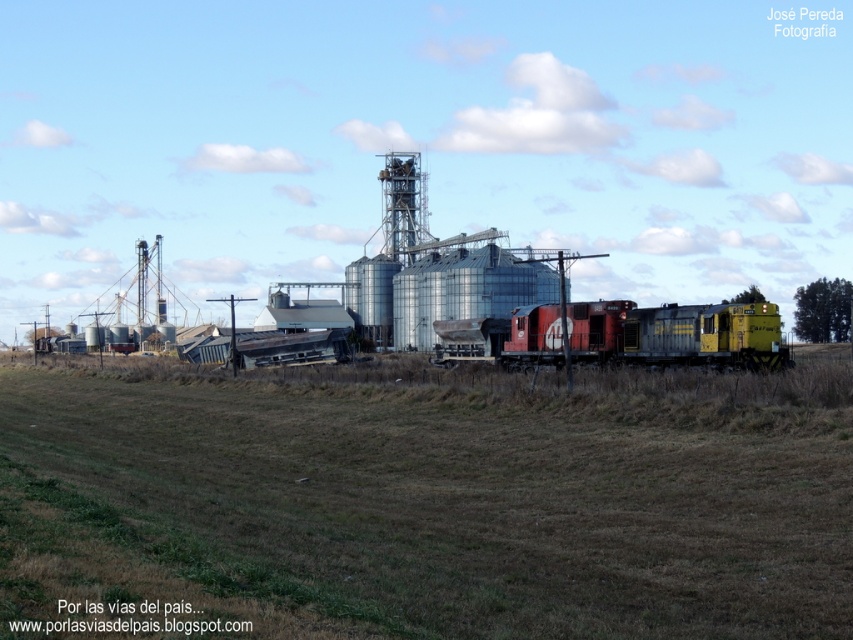
Question: Can you confirm if brown grass at center is positioned to the right of red/yellow painted metal train at center?

Choices:
 (A) yes
 (B) no

Answer: (B)

Question: Which point is farther to the camera?

Choices:
 (A) red/yellow painted metal train at center
 (B) brown grass at center

Answer: (A)

Question: Which point appears farthest from the camera in this image?

Choices:
 (A) (822, 628)
 (B) (606, 337)

Answer: (B)

Question: Is brown grass at center smaller than red/yellow painted metal train at center?

Choices:
 (A) yes
 (B) no

Answer: (B)

Question: Is the position of brown grass at center less distant than that of red/yellow painted metal train at center?

Choices:
 (A) yes
 (B) no

Answer: (A)

Question: Which of the following is the closest to the observer?

Choices:
 (A) (387, 618)
 (B) (717, 332)

Answer: (A)